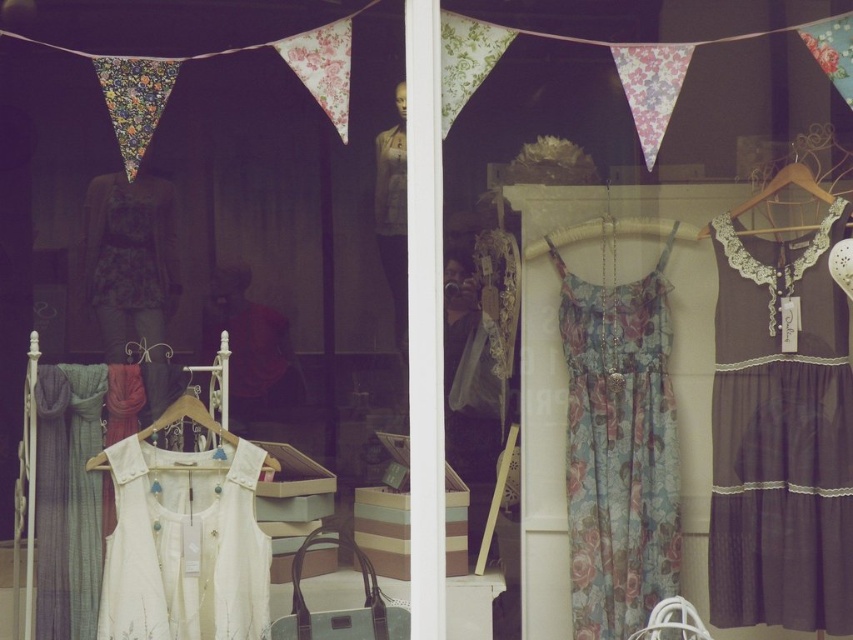
Consider the image. You are a customer in the vintage store looking at the dresses displayed through the window. You see the floral chiffon dress at center and the matte white dress at center. Which dress is closer to you?

The floral chiffon dress at center is closer to you because it is positioned under the matte white dress at center, meaning it is in front.

You are standing in front of a vintage store window and see the white cotton dress at center displayed inside. If you want to touch the dress, would you need to enter the store?

The white cotton dress at center is 6.29 meters away from viewer, so you would need to enter the store to reach it since it is located inside the store and not within touching distance from the window.

You are a customer in the vintage store and want to pick up the floral chiffon dress at center and the matte white dress at center. Which dress should you approach first to reach the one closer to you?

The floral chiffon dress at center is closer to the viewer than the matte white dress at center, so you should approach the floral chiffon dress at center first to reach the one that is closer to you.